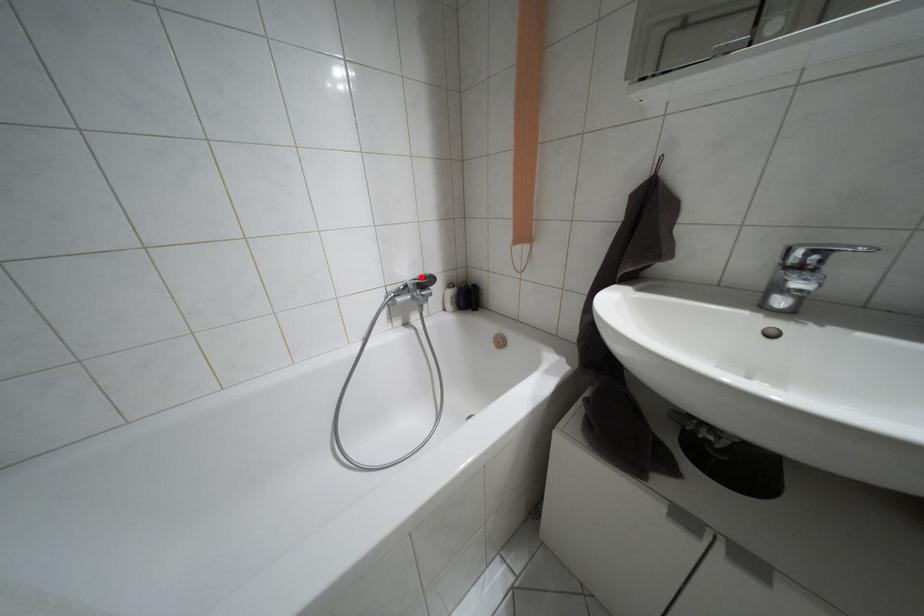
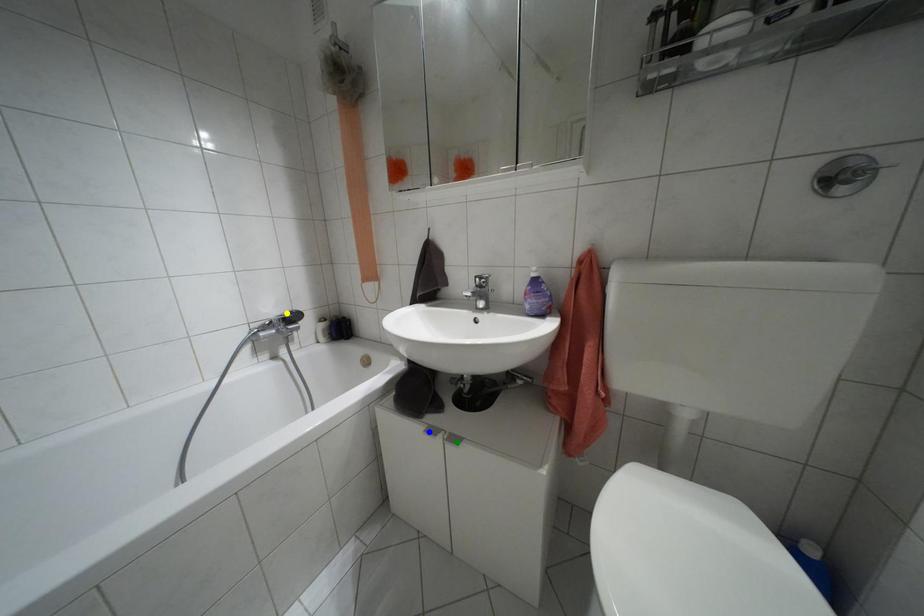
Question: I am providing you with two images of the same scene from different viewpoints. A red point is marked on the first image. You are given multiple points on the second image. Which point in image 2 is actually the same real-world point as the red point in image 1?

Choices:
 (A) green point
 (B) blue point
 (C) yellow point

Answer: (C)